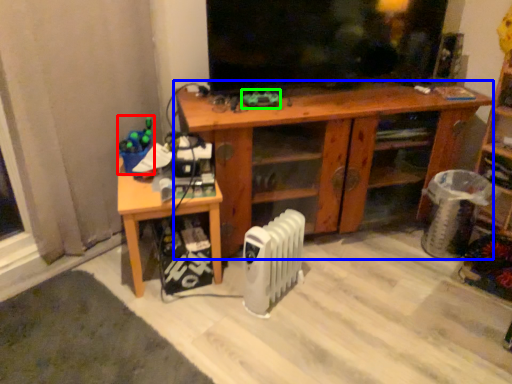
Question: Estimate the real-world distances between objects in this image. Which object is closer to toy (highlighted by a red box), desk (highlighted by a blue box) or toy (highlighted by a green box)?

Choices:
 (A) desk
 (B) toy

Answer: (B)